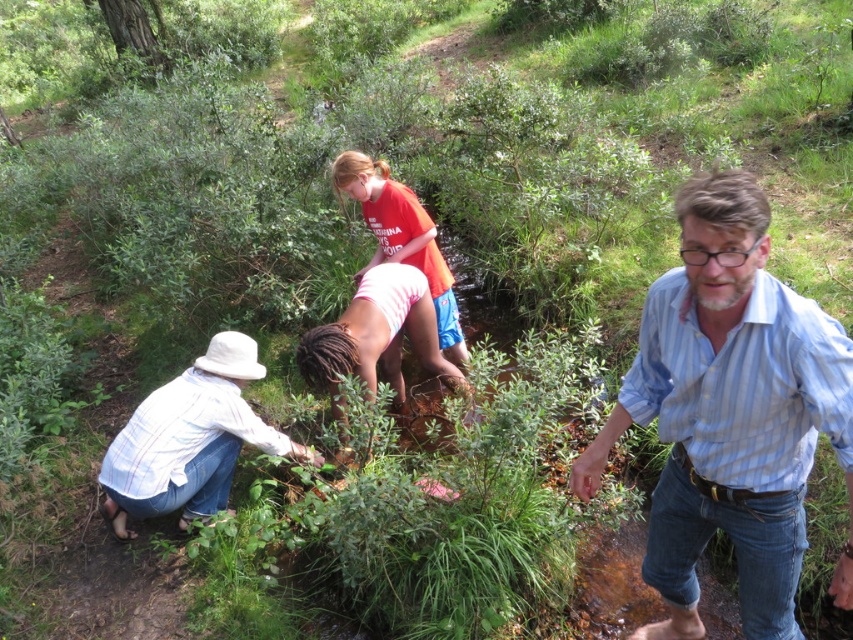
Question: Which point appears closest to the camera in this image?

Choices:
 (A) (184, 445)
 (B) (451, 285)
 (C) (317, 385)
 (D) (775, 486)

Answer: (D)

Question: Can you confirm if blue striped shirt at center is thinner than matte red shirt at center?

Choices:
 (A) no
 (B) yes

Answer: (B)

Question: Does white plaid shirt at lower left have a greater width compared to pink fabric at center?

Choices:
 (A) yes
 (B) no

Answer: (A)

Question: Considering the real-world distances, which object is farthest from the matte red shirt at center?

Choices:
 (A) white plaid shirt at lower left
 (B) blue striped shirt at center
 (C) pink fabric at center

Answer: (B)

Question: Which point appears farthest from the camera in this image?

Choices:
 (A) (370, 170)
 (B) (395, 266)
 (C) (703, 282)

Answer: (A)

Question: Is blue striped shirt at center closer to camera compared to white plaid shirt at lower left?

Choices:
 (A) no
 (B) yes

Answer: (B)